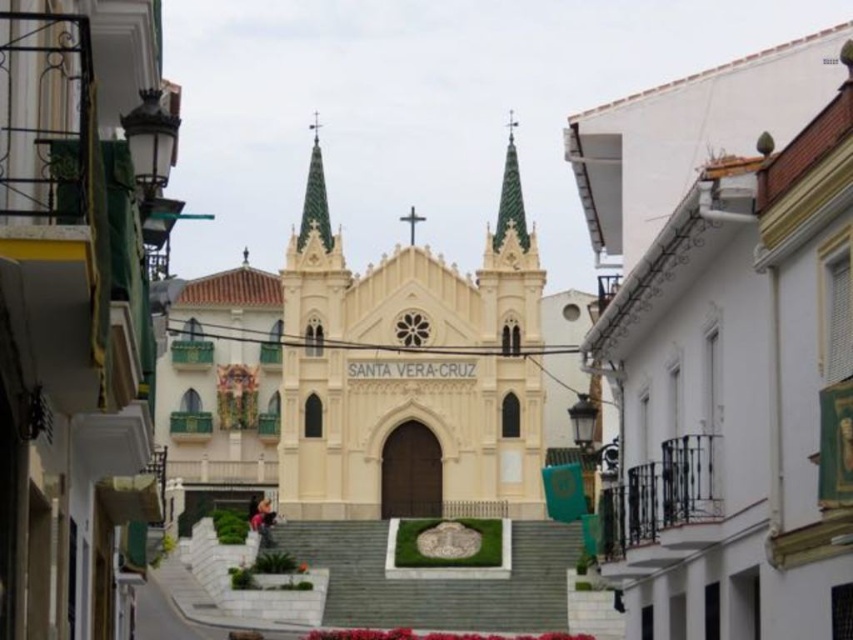
Question: Does gold textured spire at center appear over green textured spire at center?

Choices:
 (A) yes
 (B) no

Answer: (A)

Question: Is white matte building at center wider than green textured spire at center?

Choices:
 (A) no
 (B) yes

Answer: (B)

Question: Which point is closer to the camera?

Choices:
 (A) green textured spire at center
 (B) gold textured spire at center
 (C) white stone church at center

Answer: (C)

Question: Which point is closer to the camera?

Choices:
 (A) (351, 580)
 (B) (393, 285)

Answer: (A)

Question: Can you confirm if white matte building at center is wider than gray concrete stairs at center?

Choices:
 (A) yes
 (B) no

Answer: (B)

Question: Which point is closer to the camera?

Choices:
 (A) (387, 486)
 (B) (509, 192)

Answer: (A)